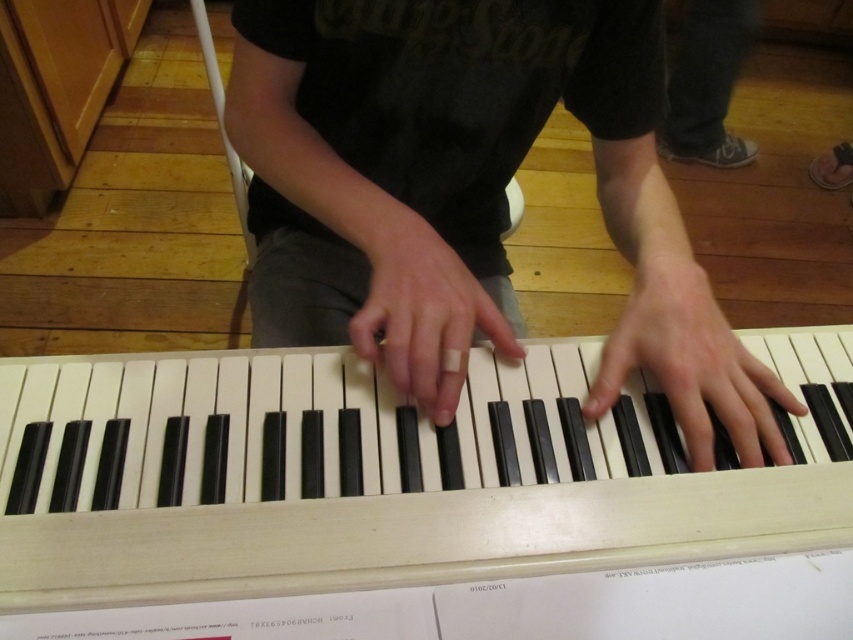
Is point (575, 60) closer to camera compared to point (401, 372)?

No, (575, 60) is behind (401, 372).

Between point (408, 209) and point (439, 307), which one is positioned behind?

Point (408, 209)

What do you see at coordinates (469, 192) in the screenshot? I see `matte black piano keys at center` at bounding box center [469, 192].

Find the location of a particular element. matte black piano keys at center is located at coordinates (469, 192).

Is matte black piano keys at center closer to the viewer compared to satin black piano keys at center?

Yes, it is in front of satin black piano keys at center.

What do you see at coordinates (469, 192) in the screenshot?
I see `matte black piano keys at center` at bounding box center [469, 192].

Does point (497, 74) come closer to viewer compared to point (630, 324)?

No, it is not.

Locate an element on the screen. This screenshot has width=853, height=640. matte black piano keys at center is located at coordinates (469, 192).

The width and height of the screenshot is (853, 640). What are the coordinates of `white plastic piano at center` in the screenshot? It's located at (384, 472).

Does white plastic piano at center come in front of white matte finger at center?

That is True.

Between point (161, 509) and point (434, 417), which one is positioned behind?

Positioned behind is point (434, 417).

The height and width of the screenshot is (640, 853). Find the location of `white plastic piano at center`. white plastic piano at center is located at coordinates (384, 472).